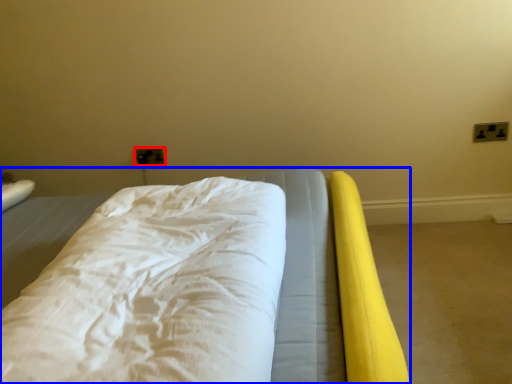
Question: Which of the following is the farthest to the observer, electric outlet (highlighted by a red box) or bed (highlighted by a blue box)?

Choices:
 (A) electric outlet
 (B) bed

Answer: (A)